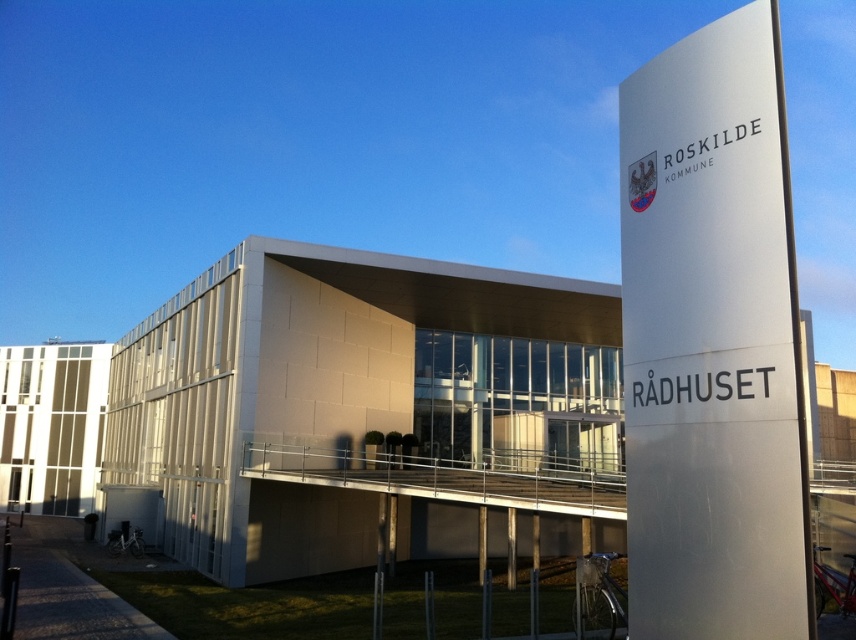
Who is more forward, (x=343, y=321) or (x=718, y=481)?

Point (x=718, y=481) is more forward.

The height and width of the screenshot is (640, 856). Describe the element at coordinates (367, 410) in the screenshot. I see `white textured building at center` at that location.

Where is `white textured building at center`? The height and width of the screenshot is (640, 856). white textured building at center is located at coordinates (367, 410).